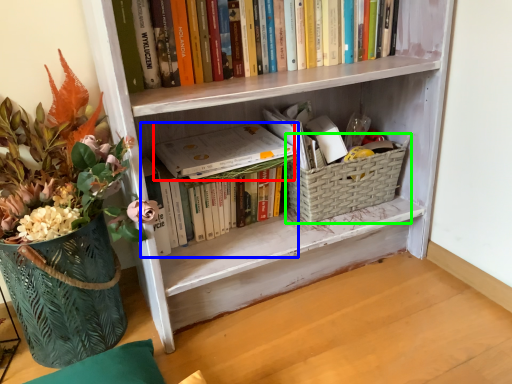
Question: Considering the real-world distances, which object is closest to paperback book (highlighted by a red box)? book (highlighted by a blue box) or basket container (highlighted by a green box).

Choices:
 (A) book
 (B) basket container

Answer: (A)